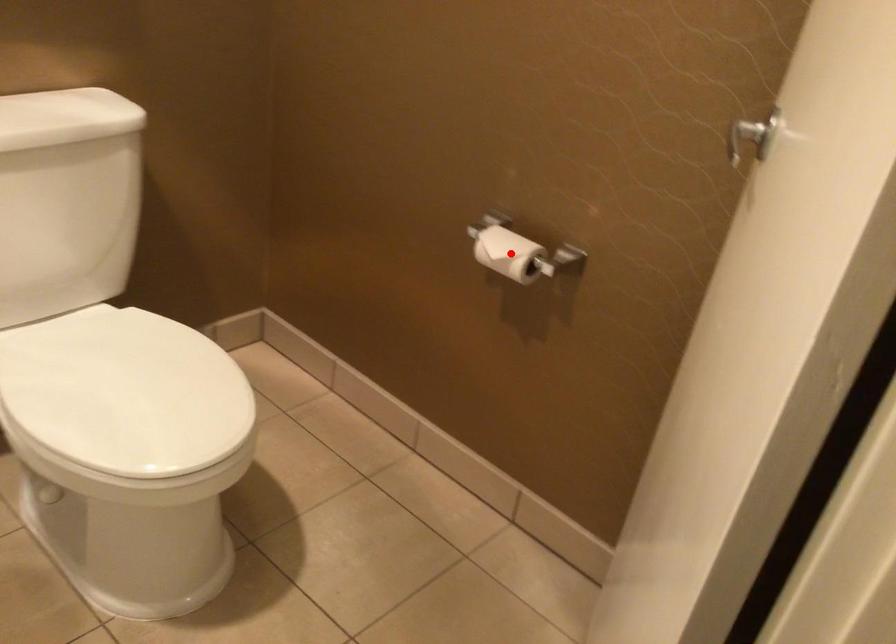
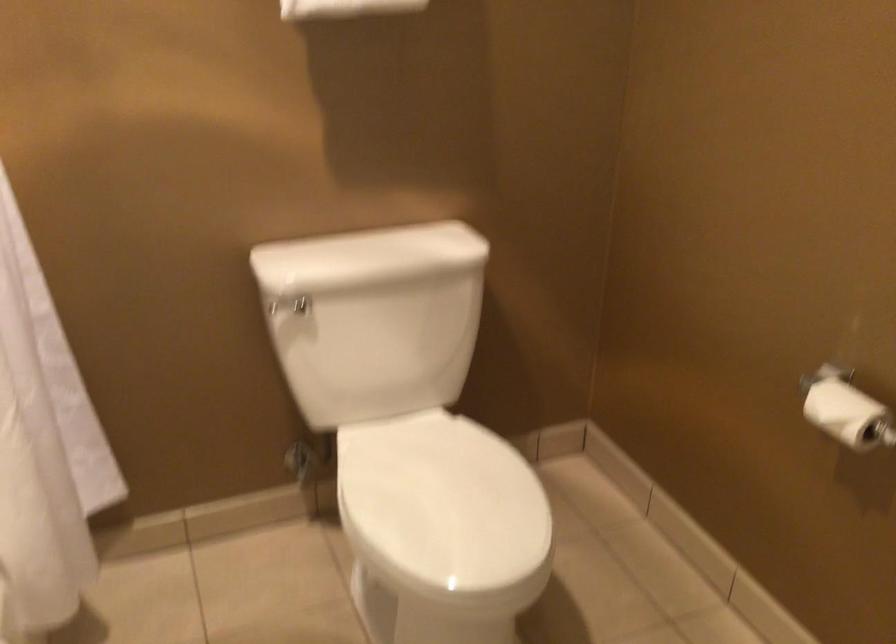
Question: I am providing you with two images of the same scene from different viewpoints. Image1 has a red point marked. In image2, the corresponding 3D location appears at what relative position? Reply with the corresponding letter.

Choices:
 (A) Closer
 (B) Farther

Answer: (A)